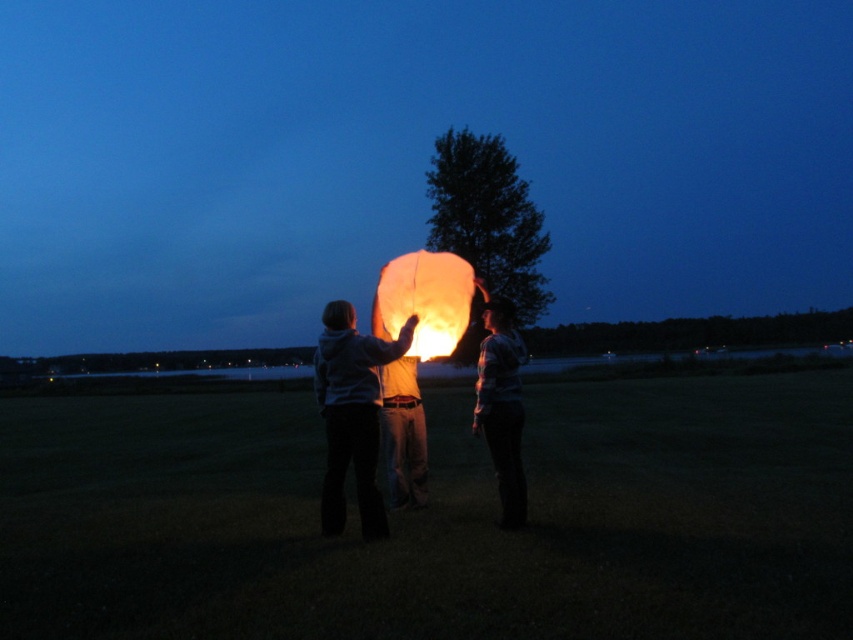
You are standing in the grassy field and want to walk towards the point marked at coordinates point (x=328, y=384) and point (x=386, y=314). Which point should you aim for if you want to reach the one closer to the horizon?

Point (x=386, y=314) is further away from you than point (x=328, y=384), so if you want to reach the one closer to the horizon, you should aim for point (x=386, y=314).

You are a photographer trying to capture the perfect shot of the matte white hoodie at center and the translucent paper lantern at center. Considering their heights, which object should you focus on first to ensure both are in frame?

The matte white hoodie at center is taller than the translucent paper lantern at center, so you should focus on the matte white hoodie at center first to ensure both fit within the frame.

You are a photographer trying to capture the moment the sky lantern is released. You need to focus on the person in the matte white hoodie at center and the person in the matte white shirt at center. Which one is positioned to the left side of the other?

The matte white hoodie at center is to the left of the matte white shirt at center.